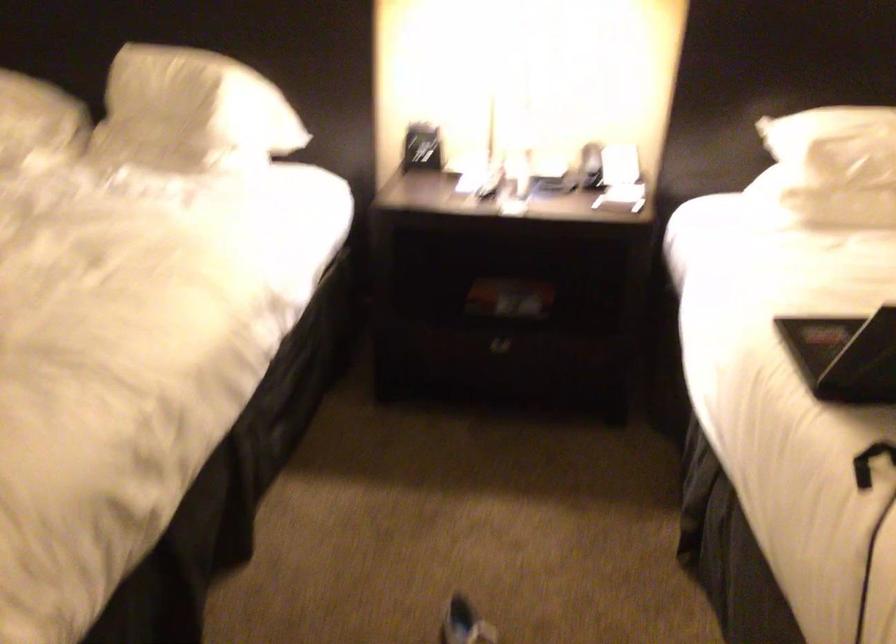
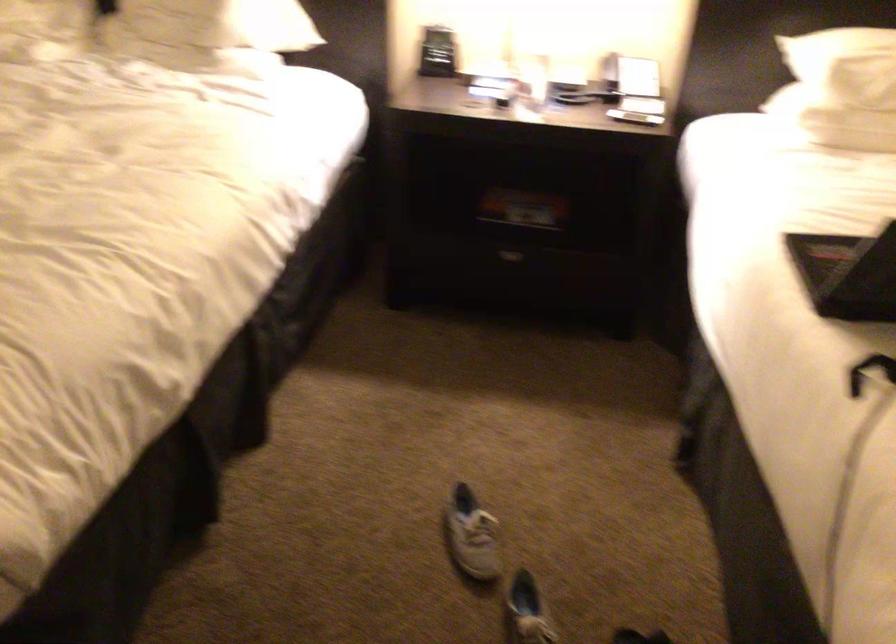
Where in the second image is the point corresponding to point 211,140 from the first image?

(227, 35)